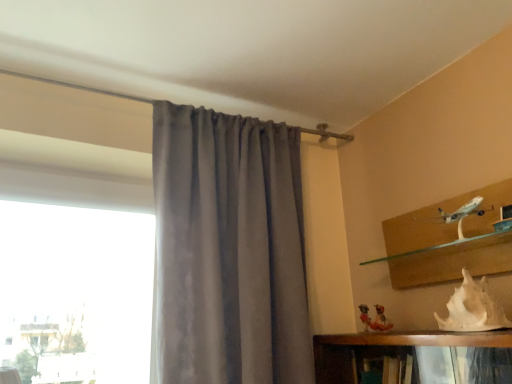
Question: Is satin gray curtain at center inside the boundaries of white matte seashell at lower right, or outside?

Choices:
 (A) inside
 (B) outside

Answer: (B)

Question: Relative to white matte seashell at lower right, is satin gray curtain at center in front or behind?

Choices:
 (A) behind
 (B) front

Answer: (A)

Question: Is satin gray curtain at center bigger or smaller than white matte seashell at lower right?

Choices:
 (A) small
 (B) big

Answer: (B)

Question: Is white matte seashell at lower right taller or shorter than satin gray curtain at center?

Choices:
 (A) short
 (B) tall

Answer: (A)

Question: From the image's perspective, is white matte seashell at lower right located above or below satin gray curtain at center?

Choices:
 (A) above
 (B) below

Answer: (B)

Question: Considering the positions of point (470, 281) and point (220, 183), is point (470, 281) closer or farther from the camera than point (220, 183)?

Choices:
 (A) closer
 (B) farther

Answer: (A)

Question: Would you say white matte seashell at lower right is inside or outside satin gray curtain at center?

Choices:
 (A) outside
 (B) inside

Answer: (A)